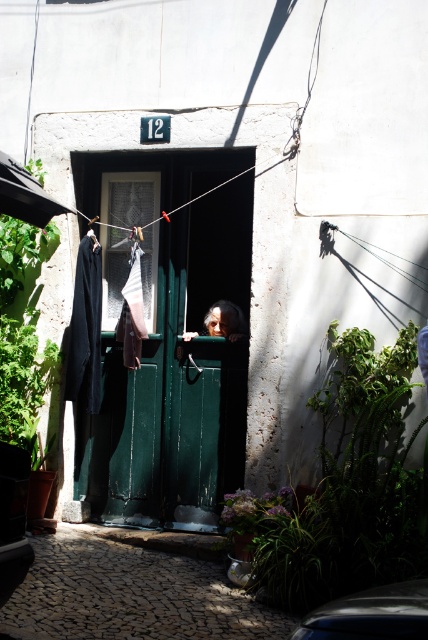
How much distance is there between cobblestone alley at lower center and smooth skin face at center?

cobblestone alley at lower center is 7.47 feet from smooth skin face at center.

Is cobblestone alley at lower center in front of smooth skin face at center?

Yes, it is.

What do you see at coordinates (130, 595) in the screenshot?
I see `cobblestone alley at lower center` at bounding box center [130, 595].

Image resolution: width=428 pixels, height=640 pixels. Identify the location of cobblestone alley at lower center. (130, 595).

Is point (59, 604) farther from camera compared to point (407, 600)?

Yes, point (59, 604) is farther from viewer.

The image size is (428, 640). In order to click on cobblestone alley at lower center in this screenshot , I will do `click(130, 595)`.

Which is above, green matte door at center or smooth skin face at center?

Positioned higher is smooth skin face at center.

Is point (238, 264) closer to viewer compared to point (214, 324)?

No, (238, 264) is behind (214, 324).

You are a GUI agent. You are given a task and a screenshot of the screen. Output one action in this format:
    pyautogui.click(x=<x>, y=<y>)
    Task: Click on the green matte door at center
    This screenshot has width=428, height=640.
    Given the screenshot: What is the action you would take?
    pyautogui.click(x=177, y=378)